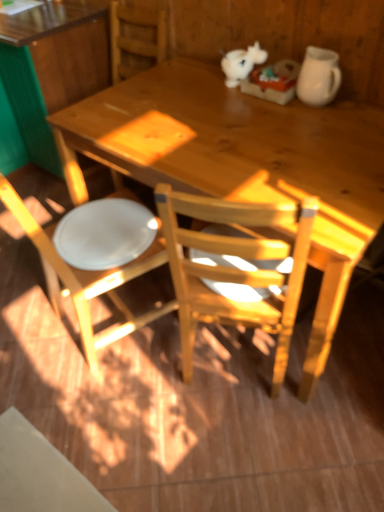
Where is `wooden desk at center, which is the second desk from left to right`? The image size is (384, 512). wooden desk at center, which is the second desk from left to right is located at coordinates (250, 164).

Measure the distance between white matte unicorn at upper center and camera.

white matte unicorn at upper center and camera are 1.64 meters apart from each other.

Where is `white matte chair at left`? Image resolution: width=384 pixels, height=512 pixels. white matte chair at left is located at coordinates (87, 279).

This screenshot has height=512, width=384. Find the location of `wooden desk at center, marked as the first desk in a right-to-left arrangement`. wooden desk at center, marked as the first desk in a right-to-left arrangement is located at coordinates (250, 164).

Is wooden desk at upper left, which is the second desk in right-to-left order, at the right side of white matte chair at left?

Incorrect, wooden desk at upper left, which is the second desk in right-to-left order, is not on the right side of white matte chair at left.

This screenshot has height=512, width=384. I want to click on desk behind the white matte chair at left, so click(48, 73).

Can you confirm if wooden desk at upper left, which is the second desk in right-to-left order, is bigger than white matte chair at left?

Yes.

From a real-world perspective, is wooden desk at upper left, placed as the 1th desk when sorted from left to right, physically above white matte chair at left?

No, from a real-world perspective, wooden desk at upper left, placed as the 1th desk when sorted from left to right, is not on top of white matte chair at left.

How different are the orientations of white glossy plate at lower left and white matte chair at left in degrees?

They differ by 6.67e-05 degrees in their facing directions.

Does white glossy plate at lower left turn towards white matte chair at left?

Yes, white glossy plate at lower left is aimed at white matte chair at left.

Does point (113, 210) come closer to viewer compared to point (53, 264)?

No, it is not.

Consider the image. From a real-world perspective, is white glossy plate at lower left beneath white matte chair at left?

No, from a real-world perspective, white glossy plate at lower left is not beneath white matte chair at left.

Is wooden desk at upper left, placed as the 1th desk when sorted from left to right, completely or partially outside of white glossy plate at lower left?

Yes, wooden desk at upper left, placed as the 1th desk when sorted from left to right, is not within white glossy plate at lower left.

Could you tell me if wooden desk at upper left, which is the second desk in right-to-left order, is facing white glossy plate at lower left?

No, wooden desk at upper left, which is the second desk in right-to-left order, is not facing towards white glossy plate at lower left.

Does wooden desk at upper left, which is the second desk in right-to-left order, have a greater width compared to white glossy plate at lower left?

Yes.

Is the position of wooden desk at upper left, placed as the 1th desk when sorted from left to right, less distant than that of white glossy plate at lower left?

No, wooden desk at upper left, placed as the 1th desk when sorted from left to right, is further to the viewer.

You are a GUI agent. You are given a task and a screenshot of the screen. Output one action in this format:
    pyautogui.click(x=<x>, y=<y>)
    Task: Click on the animal located on the right of wooden desk at center, marked as the first desk in a right-to-left arrangement
    
    Given the screenshot: What is the action you would take?
    pyautogui.click(x=241, y=63)

Between white matte unicorn at upper center and wooden desk at center, marked as the first desk in a right-to-left arrangement, which one has more height?

With more height is wooden desk at center, marked as the first desk in a right-to-left arrangement.

Is white matte unicorn at upper center looking in the opposite direction of wooden desk at center, marked as the first desk in a right-to-left arrangement?

No, white matte unicorn at upper center's orientation is not away from wooden desk at center, marked as the first desk in a right-to-left arrangement.

How distant is white matte unicorn at upper center from wooden desk at center, marked as the first desk in a right-to-left arrangement?

white matte unicorn at upper center and wooden desk at center, marked as the first desk in a right-to-left arrangement, are 44.87 centimeters apart.

Considering their positions, is white matte unicorn at upper center located in front of or behind wooden desk at upper left, placed as the 1th desk when sorted from left to right?

Clearly, white matte unicorn at upper center is in front of wooden desk at upper left, placed as the 1th desk when sorted from left to right.

Does white matte unicorn at upper center appear on the right side of wooden desk at upper left, placed as the 1th desk when sorted from left to right?

Yes, white matte unicorn at upper center is to the right of wooden desk at upper left, placed as the 1th desk when sorted from left to right.

Is white matte unicorn at upper center outside of wooden desk at upper left, placed as the 1th desk when sorted from left to right?

white matte unicorn at upper center is positioned outside wooden desk at upper left, placed as the 1th desk when sorted from left to right.

Based on the photo, is white matte unicorn at upper center beside white glossy plate at lower left?

No.

Is white matte unicorn at upper center positioned with its back to white glossy plate at lower left?

No.

Can you confirm if white matte unicorn at upper center is positioned to the right of white glossy plate at lower left?

Indeed, white matte unicorn at upper center is positioned on the right side of white glossy plate at lower left.

From the image's perspective, is white matte unicorn at upper center above white glossy plate at lower left?

Indeed, from the image's perspective, white matte unicorn at upper center is shown above white glossy plate at lower left.

Is wooden desk at upper left, placed as the 1th desk when sorted from left to right, facing away from white matte unicorn at upper center?

No, wooden desk at upper left, placed as the 1th desk when sorted from left to right,'s orientation is not away from white matte unicorn at upper center.

Considering the relative positions of wooden desk at upper left, which is the second desk in right-to-left order, and white matte unicorn at upper center in the image provided, is wooden desk at upper left, which is the second desk in right-to-left order, in front of white matte unicorn at upper center?

No, it is not.

Is wooden desk at upper left, which is the second desk in right-to-left order, to the right of white matte unicorn at upper center from the viewer's perspective?

No, wooden desk at upper left, which is the second desk in right-to-left order, is not to the right of white matte unicorn at upper center.

Locate an element on the screen. animal located on the right of wooden desk at upper left, which is the second desk in right-to-left order is located at coordinates (241, 63).

This screenshot has width=384, height=512. In order to click on the 1st desk located beneath the white matte chair at left (from a real-world perspective) in this screenshot , I will do `click(48, 73)`.

The width and height of the screenshot is (384, 512). What are the coordinates of `plate behind the white matte chair at left` in the screenshot? It's located at pos(105,233).

From the image, which object appears to be nearer to white matte unicorn at upper center, white glossy plate at lower left or wooden desk at upper left, placed as the 1th desk when sorted from left to right?

white glossy plate at lower left is closer to white matte unicorn at upper center.

Consider the image. Which object lies further to the anchor point wooden desk at upper left, which is the second desk in right-to-left order, white matte unicorn at upper center or wooden desk at center, marked as the first desk in a right-to-left arrangement?

white matte unicorn at upper center.

Which object lies further to the anchor point white matte chair at left, white glossy plate at lower left or wooden desk at center, which is the second desk from left to right?

wooden desk at center, which is the second desk from left to right.

Which object lies nearer to the anchor point white glossy plate at lower left, white matte unicorn at upper center or wooden desk at center, marked as the first desk in a right-to-left arrangement?

The object closer to white glossy plate at lower left is wooden desk at center, marked as the first desk in a right-to-left arrangement.

Considering their positions, is white glossy plate at lower left positioned further to white matte unicorn at upper center than white matte chair at left?

The object further to white matte unicorn at upper center is white matte chair at left.

Based on their spatial positions, is wooden desk at center, which is the second desk from left to right, or white matte unicorn at upper center closer to wooden desk at upper left, which is the second desk in right-to-left order?

Among the two, wooden desk at center, which is the second desk from left to right, is located nearer to wooden desk at upper left, which is the second desk in right-to-left order.

From the image, which object appears to be nearer to wooden desk at upper left, which is the second desk in right-to-left order, white matte chair at left or white glossy plate at lower left?

white glossy plate at lower left lies closer to wooden desk at upper left, which is the second desk in right-to-left order, than the other object.

Considering their positions, is white matte unicorn at upper center positioned further to white glossy plate at lower left than wooden desk at upper left, placed as the 1th desk when sorted from left to right?

Among the two, wooden desk at upper left, placed as the 1th desk when sorted from left to right, is located further to white glossy plate at lower left.

Where is `desk between white matte unicorn at upper center and white matte chair at left vertically`? desk between white matte unicorn at upper center and white matte chair at left vertically is located at coordinates [250, 164].

At what (x,y) coordinates should I click in order to perform the action: click on plate located between white matte chair at left and wooden desk at center, marked as the first desk in a right-to-left arrangement, in the left-right direction. Please return your answer as a coordinate pair (x, y). Looking at the image, I should click on (105, 233).

Locate an element on the screen. The height and width of the screenshot is (512, 384). plate situated between wooden desk at upper left, placed as the 1th desk when sorted from left to right, and white matte unicorn at upper center from left to right is located at coordinates (105, 233).

I want to click on chair between wooden desk at upper left, placed as the 1th desk when sorted from left to right, and white matte unicorn at upper center, in the horizontal direction, so click(87, 279).